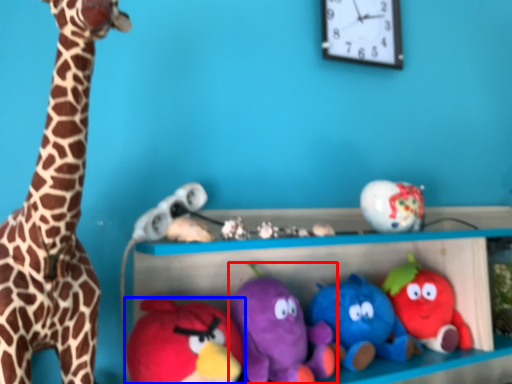
Question: Which object is closer to the camera taking this photo, toy (highlighted by a red box) or toy (highlighted by a blue box)?

Choices:
 (A) toy
 (B) toy

Answer: (B)